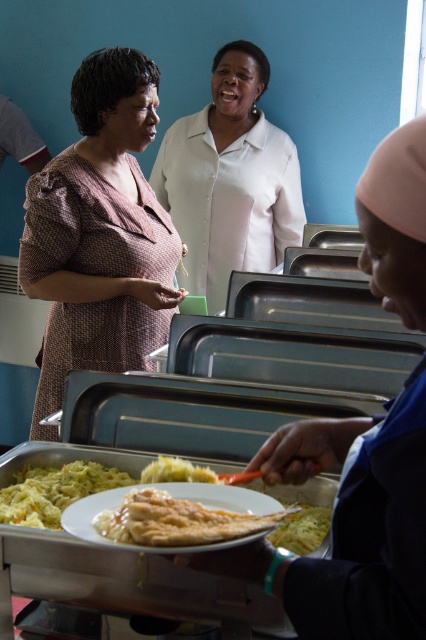
You are standing at the entrance of the dining area and want to take a photo of the white smooth shirt at upper center. If your camera has a maximum focus range of 10 feet, will you be able to capture it clearly?

The white smooth shirt at upper center is 9.09 feet away from the camera, which is within the 10 feet maximum focus range. Therefore, you can capture it clearly.

You are standing in the dining area and want to pick up the utensil. The utensil is at point (118, 288) and the plate is at point (195, 120). Which point should you reach for first to grab the utensil before the plate?

You should reach for point (118, 288) first because it is closer to you than point (195, 120), so you can grab the utensil before the plate.